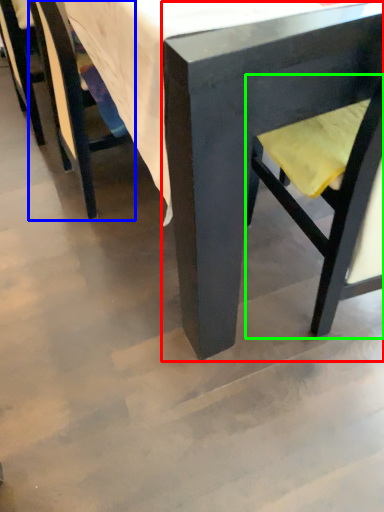
Question: Based on their relative distances, which object is farther from chair (highlighted by a red box)? Choose from chair (highlighted by a blue box) and swivel chair (highlighted by a green box).

Choices:
 (A) chair
 (B) swivel chair

Answer: (A)